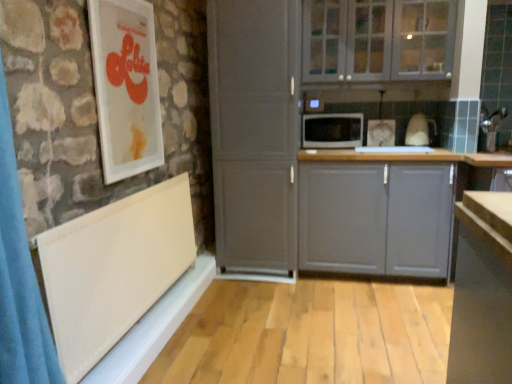
The image size is (512, 384). Identify the location of free location in front of white matte cabinet at center. (273, 303).